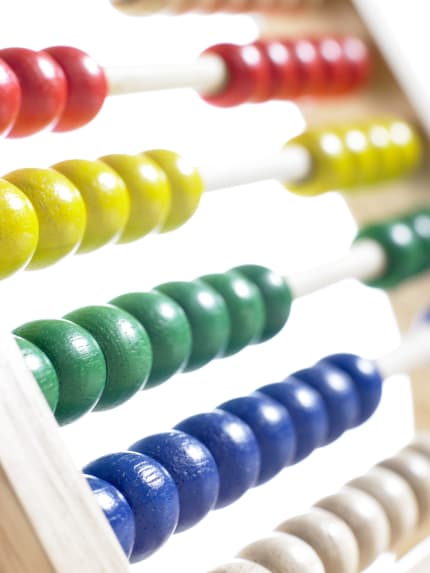
You are a GUI agent. You are given a task and a screenshot of the screen. Output one action in this format:
    pyautogui.click(x=<x>, y=<y>)
    Task: Click on the green abacus beads
    This screenshot has width=430, height=573.
    Given the screenshot: What is the action you would take?
    pyautogui.click(x=46, y=367), pyautogui.click(x=89, y=361), pyautogui.click(x=124, y=352), pyautogui.click(x=168, y=341), pyautogui.click(x=214, y=328), pyautogui.click(x=240, y=315), pyautogui.click(x=278, y=300), pyautogui.click(x=398, y=256), pyautogui.click(x=426, y=240)